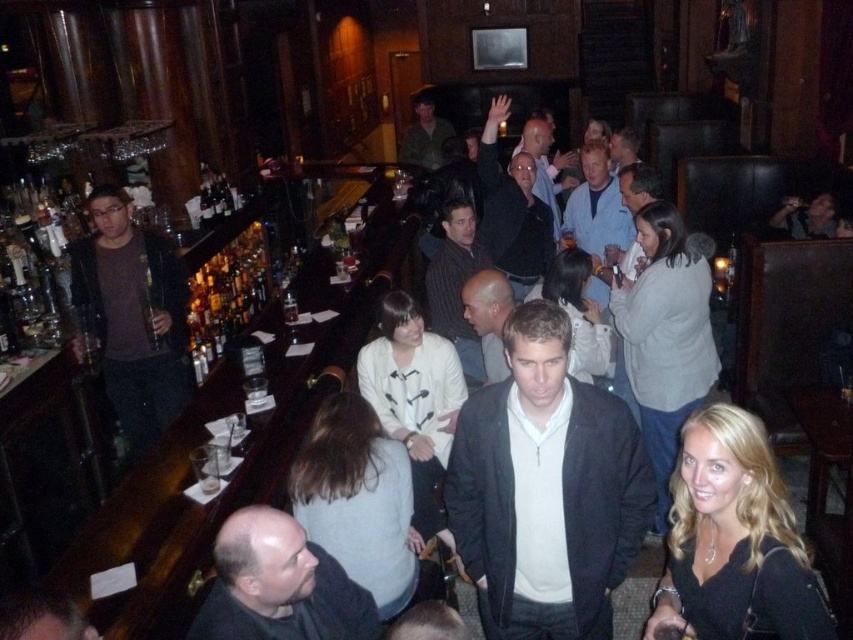
Question: Does matte brown jacket at left appear on the left side of striped shirt at center?

Choices:
 (A) no
 (B) yes

Answer: (B)

Question: Which point is farther to the camera?

Choices:
 (A) light brown hair at center
 (B) striped shirt at center
 (C) green matte shirt at center

Answer: (C)

Question: Which object appears farthest from the camera in this image?

Choices:
 (A) green matte shirt at center
 (B) striped shirt at center
 (C) light brown hair at center

Answer: (A)

Question: Is matte black jacket at center wider than dark gray sweater at lower left?

Choices:
 (A) yes
 (B) no

Answer: (A)

Question: Which object is the closest to the matte brown jacket at left?

Choices:
 (A) light brown hair at center
 (B) dark gray sweater at lower left

Answer: (A)

Question: Does matte brown jacket at left appear on the left side of light brown hair at center?

Choices:
 (A) yes
 (B) no

Answer: (A)